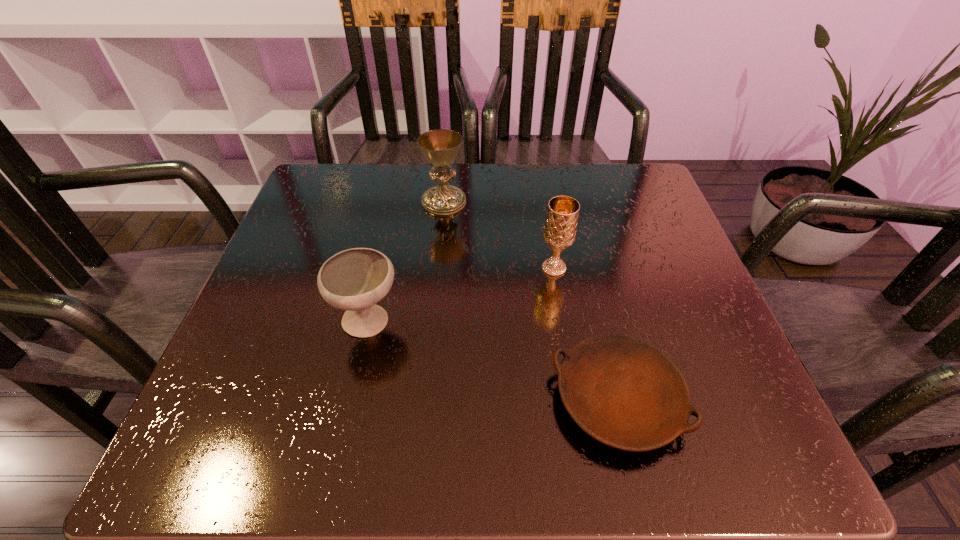
I want to click on free space located on the back of the plate, so click(583, 254).

What are the coordinates of `object that is positioned at the far edge` in the screenshot? It's located at (440, 147).

This screenshot has width=960, height=540. Identify the location of object at the near edge. (625, 393).

You are a GUI agent. You are given a task and a screenshot of the screen. Output one action in this format:
    pyautogui.click(x=<x>, y=<y>)
    Task: Click on the object present at the right edge
    The width and height of the screenshot is (960, 540).
    Given the screenshot: What is the action you would take?
    pyautogui.click(x=625, y=393)

Locate an element on the screen. object that is at the near right corner is located at coordinates (625, 393).

In the image, there is a desktop. At what (x,y) coordinates should I click in order to perform the action: click on vacant space at the far edge. Please return your answer as a coordinate pair (x, y). Looking at the image, I should click on (594, 213).

In the image, there is a desktop. Where is `free space at the near edge`? The image size is (960, 540). free space at the near edge is located at coordinates (369, 435).

Image resolution: width=960 pixels, height=540 pixels. Identify the location of free space at the left edge of the desktop. (238, 332).

In the image, there is a desktop. Where is `free space at the right edge`? The width and height of the screenshot is (960, 540). free space at the right edge is located at coordinates coord(704,343).

The image size is (960, 540). What are the coordinates of `vacant area at the far left corner` in the screenshot? It's located at (312, 217).